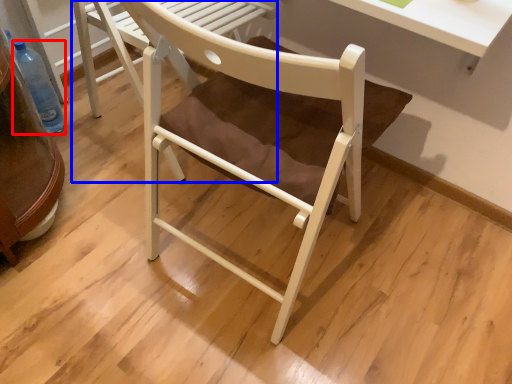
Question: Which of the following is the closest to the observer, bottle (highlighted by a red box) or chair (highlighted by a blue box)?

Choices:
 (A) bottle
 (B) chair

Answer: (B)